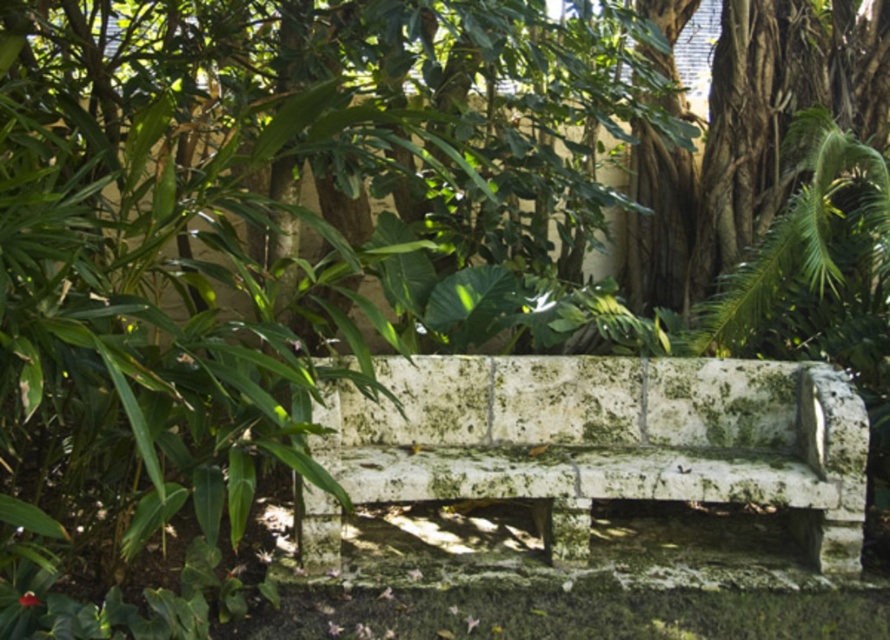
Is mossy stone bench at center shorter than green mossy stone bench at upper center?

Indeed, mossy stone bench at center has a lesser height compared to green mossy stone bench at upper center.

Can you confirm if mossy stone bench at center is thinner than green mossy stone bench at upper center?

Incorrect, mossy stone bench at center's width is not less than green mossy stone bench at upper center's.

Where is `mossy stone bench at center`? This screenshot has width=890, height=640. mossy stone bench at center is located at coordinates (608, 440).

Find the location of a particular element. mossy stone bench at center is located at coordinates (608, 440).